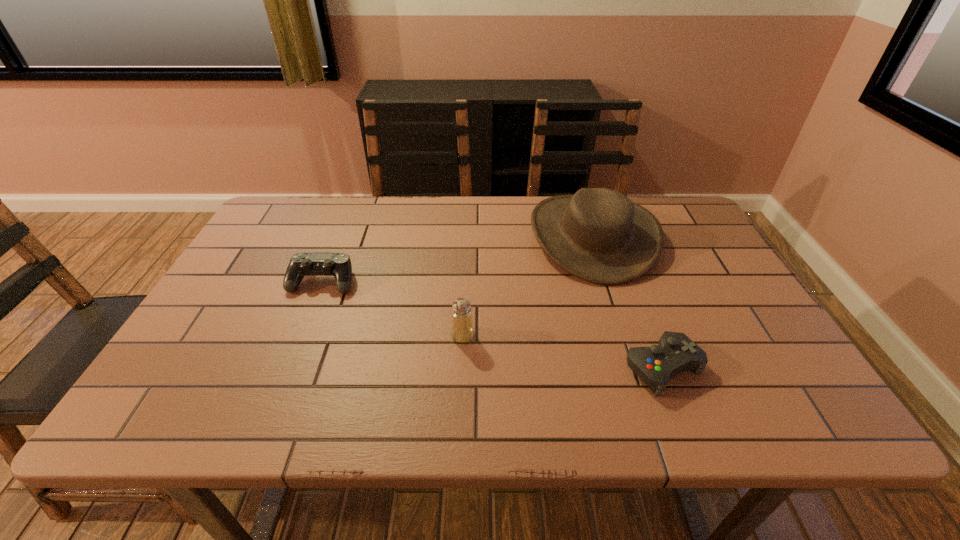
In order to click on vacant point located between the leftmost object and the cowboy hat in this screenshot , I will do coord(458,259).

At what (x,y) coordinates should I click in order to perform the action: click on vacant space that is in between the leftmost object and the third shortest object. Please return your answer as a coordinate pair (x, y). The image size is (960, 540). Looking at the image, I should click on (393, 308).

Select which object is the closest to the saltshaker. Please provide its 2D coordinates. Your answer should be formatted as a tuple, i.e. [(x, y)], where the tuple contains the x and y coordinates of a point satisfying the conditions above.

[(599, 235)]

Choose which object is the nearest neighbor to the cowboy hat. Please provide its 2D coordinates. Your answer should be formatted as a tuple, i.e. [(x, y)], where the tuple contains the x and y coordinates of a point satisfying the conditions above.

[(675, 352)]

Locate an element on the screen. The width and height of the screenshot is (960, 540). free spot that satisfies the following two spatial constraints: 1. on the back side of the farther control; 2. on the left side of the tallest object is located at coordinates (341, 236).

Where is `free space that satisfies the following two spatial constraints: 1. on the front side of the second tallest object; 2. on the right side of the leftmost object`? free space that satisfies the following two spatial constraints: 1. on the front side of the second tallest object; 2. on the right side of the leftmost object is located at coordinates (300, 335).

This screenshot has height=540, width=960. Find the location of `vacant space that satisfies the following two spatial constraints: 1. on the front side of the right control; 2. on the right side of the tallest object`. vacant space that satisfies the following two spatial constraints: 1. on the front side of the right control; 2. on the right side of the tallest object is located at coordinates (636, 368).

At what (x,y) coordinates should I click in order to perform the action: click on free spot that satisfies the following two spatial constraints: 1. on the front side of the farther control; 2. on the right side of the nearer control. Please return your answer as a coordinate pair (x, y). The width and height of the screenshot is (960, 540). Looking at the image, I should click on (288, 368).